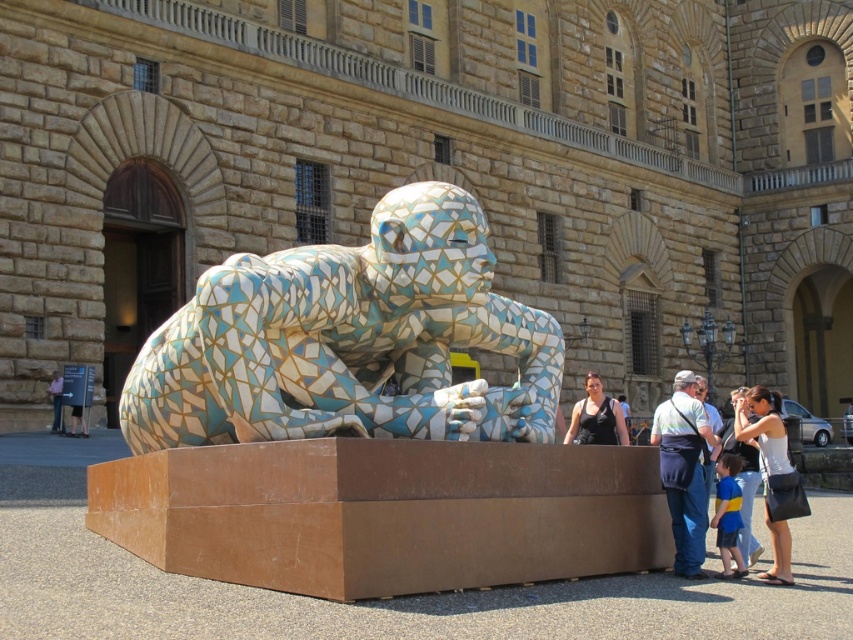
Who is higher up, matte black tank top at center or matte black shirt at lower left?

matte black tank top at center

Does point (589, 440) come in front of point (53, 403)?

That is True.

The width and height of the screenshot is (853, 640). I want to click on matte black tank top at center, so click(596, 417).

Which is behind, point (689, 468) or point (53, 381)?

Point (53, 381)

Does denim jeans at lower right have a smaller size compared to matte black shirt at lower left?

No, denim jeans at lower right is not smaller than matte black shirt at lower left.

Identify the location of denim jeans at lower right. The height and width of the screenshot is (640, 853). (683, 470).

I want to click on denim jeans at lower right, so 683,470.

Measure the distance between striped shirt at lower right and camera.

striped shirt at lower right and camera are 54.01 feet apart from each other.

Which is above, striped shirt at lower right or matte black shirt at lower left?

matte black shirt at lower left is above.

Does point (741, 547) come closer to viewer compared to point (56, 378)?

Yes, it is.

You are a GUI agent. You are given a task and a screenshot of the screen. Output one action in this format:
    pyautogui.click(x=<x>, y=<y>)
    Task: Click on the striped shirt at lower right
    
    Given the screenshot: What is the action you would take?
    pyautogui.click(x=743, y=486)